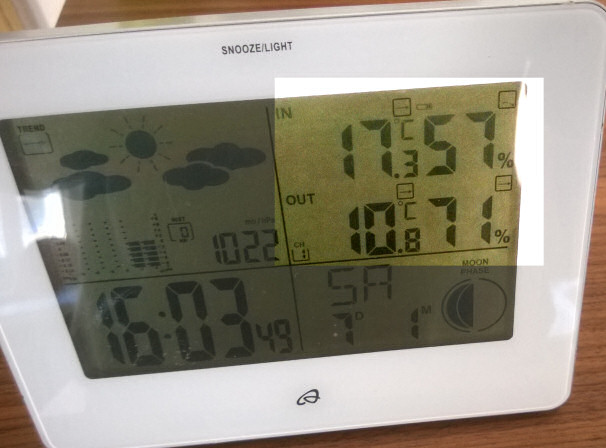
At what (x,y) coordinates should I click in order to perform the action: click on white frame. Please return your answer as a coordinate pair (x, y). Looking at the image, I should click on (571, 165).